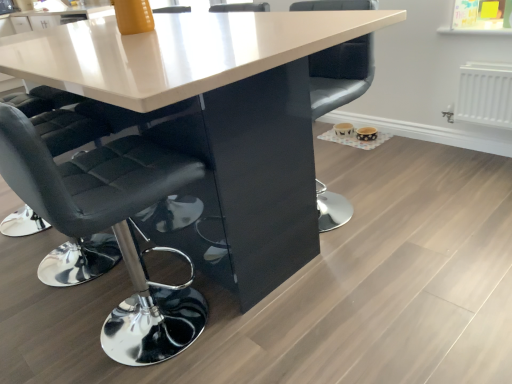
You are a GUI agent. You are given a task and a screenshot of the screen. Output one action in this format:
    pyautogui.click(x=<x>, y=<y>)
    Task: Click on the vacant space behind black leather chair at center, which is the second chair in left-to-right order
    The height and width of the screenshot is (384, 512).
    Given the screenshot: What is the action you would take?
    pyautogui.click(x=342, y=166)